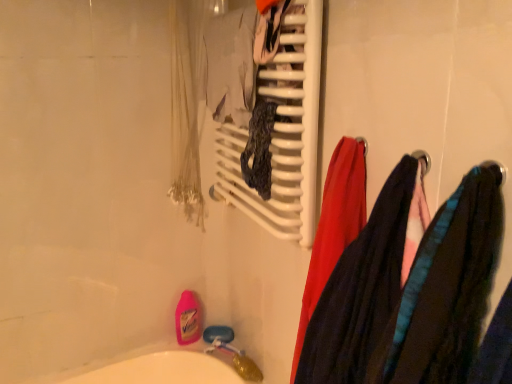
This screenshot has height=384, width=512. Identify the location of velvet-like fabric at right, the 2th clothing in the front-to-back sequence. (365, 284).

Where is `white plastic towel rack at upper center`? white plastic towel rack at upper center is located at coordinates (282, 131).

The image size is (512, 384). What are the coordinates of `velvet-like fabric at right, the 1th clothing positioned from the back` in the screenshot? It's located at (365, 284).

Considering the positions of objects velvet-like fabric scarf at right, the first clothing when ordered from front to back, and white plastic towel rack at upper center in the image provided, who is behind, velvet-like fabric scarf at right, the first clothing when ordered from front to back, or white plastic towel rack at upper center?

white plastic towel rack at upper center is behind.

From a real-world perspective, which is physically above, velvet-like fabric scarf at right, the first clothing when ordered from front to back, or white plastic towel rack at upper center?

white plastic towel rack at upper center is physically above.

Could you tell me if velvet-like fabric scarf at right, the first clothing when ordered from front to back, is facing white plastic towel rack at upper center?

No, velvet-like fabric scarf at right, the first clothing when ordered from front to back, is not oriented towards white plastic towel rack at upper center.

Is velvet-like fabric at right, the 2th clothing in the front-to-back sequence, touching velvet-like fabric scarf at right, the first clothing when ordered from front to back?

Yes, velvet-like fabric at right, the 2th clothing in the front-to-back sequence, and velvet-like fabric scarf at right, the first clothing when ordered from front to back, clearly make contact.

How many degrees apart are the facing directions of velvet-like fabric at right, the 1th clothing positioned from the back, and velvet-like fabric scarf at right, the first clothing when ordered from front to back?

The facing directions of velvet-like fabric at right, the 1th clothing positioned from the back, and velvet-like fabric scarf at right, the first clothing when ordered from front to back, are 1.82e-05 degrees apart.

What are the coordinates of `clothing lying in front of the velvet-like fabric at right, the 2th clothing in the front-to-back sequence` in the screenshot? It's located at (446, 288).

From the image's perspective, relative to velvet-like fabric scarf at right, which is counted as the second clothing, starting from the back, is velvet-like fabric at right, the 1th clothing positioned from the back, above or below?

Clearly, from the image's perspective, velvet-like fabric at right, the 1th clothing positioned from the back, is below velvet-like fabric scarf at right, which is counted as the second clothing, starting from the back.

Is velvet-like fabric at right, the 2th clothing in the front-to-back sequence, at the left side of white plastic towel rack at upper center?

In fact, velvet-like fabric at right, the 2th clothing in the front-to-back sequence, is to the right of white plastic towel rack at upper center.

From the image's perspective, is velvet-like fabric at right, the 1th clothing positioned from the back, under white plastic towel rack at upper center?

Yes.

From their relative heights in the image, would you say velvet-like fabric at right, the 1th clothing positioned from the back, is taller or shorter than white plastic towel rack at upper center?

velvet-like fabric at right, the 1th clothing positioned from the back, is shorter than white plastic towel rack at upper center.

How far apart are velvet-like fabric at right, the 2th clothing in the front-to-back sequence, and white plastic towel rack at upper center?

Result: velvet-like fabric at right, the 2th clothing in the front-to-back sequence, and white plastic towel rack at upper center are 12.43 inches apart.

From the image's perspective, relative to velvet-like fabric scarf at right, the first clothing when ordered from front to back, is white plastic towel rack at upper center above or below?

Clearly, from the image's perspective, white plastic towel rack at upper center is above velvet-like fabric scarf at right, the first clothing when ordered from front to back.

Considering the sizes of objects white plastic towel rack at upper center and velvet-like fabric scarf at right, which is counted as the second clothing, starting from the back, in the image provided, who is thinner, white plastic towel rack at upper center or velvet-like fabric scarf at right, which is counted as the second clothing, starting from the back,?

Thinner between the two is white plastic towel rack at upper center.

Which object is positioned more to the left, white plastic towel rack at upper center or velvet-like fabric scarf at right, the first clothing when ordered from front to back?

white plastic towel rack at upper center.

From the image's perspective, is white plastic towel rack at upper center located beneath velvet-like fabric at right, the 2th clothing in the front-to-back sequence?

Incorrect, from the image's perspective, white plastic towel rack at upper center is higher than velvet-like fabric at right, the 2th clothing in the front-to-back sequence.

Considering the relative sizes of white plastic towel rack at upper center and velvet-like fabric at right, the 1th clothing positioned from the back, in the image provided, is white plastic towel rack at upper center smaller than velvet-like fabric at right, the 1th clothing positioned from the back,?

No, white plastic towel rack at upper center is not smaller than velvet-like fabric at right, the 1th clothing positioned from the back.

Consider the image. Is the surface of white plastic towel rack at upper center in direct contact with velvet-like fabric at right, the 2th clothing in the front-to-back sequence?

No, white plastic towel rack at upper center is not making contact with velvet-like fabric at right, the 2th clothing in the front-to-back sequence.

Can you confirm if velvet-like fabric scarf at right, the first clothing when ordered from front to back, is bigger than velvet-like fabric at right, the 1th clothing positioned from the back?

Actually, velvet-like fabric scarf at right, the first clothing when ordered from front to back, might be smaller than velvet-like fabric at right, the 1th clothing positioned from the back.

Is velvet-like fabric scarf at right, which is counted as the second clothing, starting from the back, directly adjacent to velvet-like fabric at right, the 1th clothing positioned from the back?

Yes, velvet-like fabric scarf at right, which is counted as the second clothing, starting from the back, is with velvet-like fabric at right, the 1th clothing positioned from the back.

Is velvet-like fabric scarf at right, which is counted as the second clothing, starting from the back, shorter than velvet-like fabric at right, the 1th clothing positioned from the back?

Indeed, velvet-like fabric scarf at right, which is counted as the second clothing, starting from the back, has a lesser height compared to velvet-like fabric at right, the 1th clothing positioned from the back.

Which is in front, point (456, 296) or point (396, 294)?

Positioned in front is point (456, 296).

From a real-world perspective, count 1st clothings downward from the white plastic towel rack at upper center and point to it. Please provide its 2D coordinates.

[(446, 288)]

Find the location of a particular element. This screenshot has height=384, width=512. clothing above the velvet-like fabric at right, the 2th clothing in the front-to-back sequence (from a real-world perspective) is located at coordinates (446, 288).

Based on their spatial positions, is velvet-like fabric at right, the 1th clothing positioned from the back, or velvet-like fabric scarf at right, the first clothing when ordered from front to back, further from white plastic towel rack at upper center?

Based on the image, velvet-like fabric scarf at right, the first clothing when ordered from front to back, appears to be further to white plastic towel rack at upper center.

Estimate the real-world distances between objects in this image. Which object is closer to velvet-like fabric at right, the 1th clothing positioned from the back, velvet-like fabric scarf at right, the first clothing when ordered from front to back, or white plastic towel rack at upper center?

velvet-like fabric scarf at right, the first clothing when ordered from front to back.

Based on their spatial positions, is velvet-like fabric scarf at right, the first clothing when ordered from front to back, or velvet-like fabric at right, the 2th clothing in the front-to-back sequence, closer to white plastic towel rack at upper center?

Among the two, velvet-like fabric at right, the 2th clothing in the front-to-back sequence, is located nearer to white plastic towel rack at upper center.

Estimate the real-world distances between objects in this image. Which object is closer to velvet-like fabric scarf at right, the first clothing when ordered from front to back, white plastic towel rack at upper center or velvet-like fabric at right, the 2th clothing in the front-to-back sequence?

Among the two, velvet-like fabric at right, the 2th clothing in the front-to-back sequence, is located nearer to velvet-like fabric scarf at right, the first clothing when ordered from front to back.

From the image, which object appears to be nearer to velvet-like fabric at right, the 1th clothing positioned from the back, white plastic towel rack at upper center or velvet-like fabric scarf at right, the first clothing when ordered from front to back?

velvet-like fabric scarf at right, the first clothing when ordered from front to back, is closer to velvet-like fabric at right, the 1th clothing positioned from the back.

Based on the photo, when comparing their distances from velvet-like fabric scarf at right, the first clothing when ordered from front to back, does velvet-like fabric at right, the 2th clothing in the front-to-back sequence, or white plastic towel rack at upper center seem closer?

The object closer to velvet-like fabric scarf at right, the first clothing when ordered from front to back, is velvet-like fabric at right, the 2th clothing in the front-to-back sequence.

This screenshot has width=512, height=384. I want to click on clothing between white plastic towel rack at upper center and velvet-like fabric at right, the 2th clothing in the front-to-back sequence, from top to bottom, so click(446, 288).